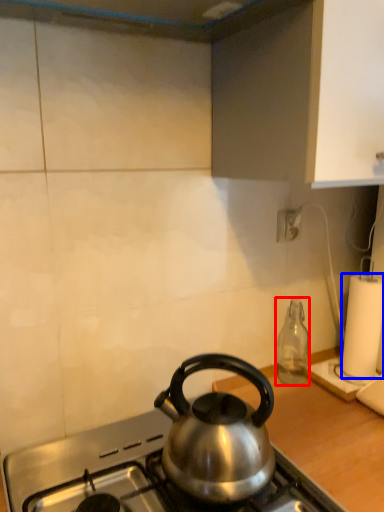
Question: Which point is further to the camera, bottle (highlighted by a red box) or paper towel (highlighted by a blue box)?

Choices:
 (A) bottle
 (B) paper towel

Answer: (B)